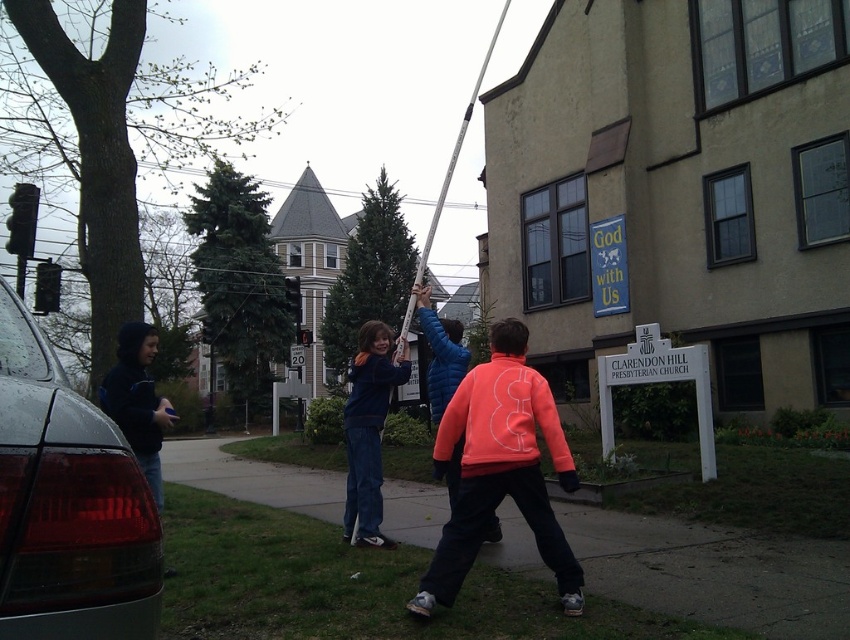
You are standing at the entrance of Clarendon Hill Presbyterian Church and notice a shiny black car at left and blue denim pants at center. Which object is nearer to you?

The shiny black car at left is closer to the viewer than the blue denim pants at center.

You are a delivery person trying to park your 1.8 meters tall delivery van. You see the smooth concrete sidewalk at center and the shiny black car at left. Which one is taller and can accommodate your van?

The smooth concrete sidewalk at center is much taller than the shiny black car at left. Since your delivery van is 1.8 meters tall, it can fit under the smooth concrete sidewalk at center as it is taller than the van, but the shiny black car at left is shorter and may not provide enough clearance.

You are a delivery person trying to navigate through the courtyard to deliver a package to the church entrance. There are two people in the scene wearing an orange fleece jacket at center and blue denim pants at center. What is the minimum width of the path needed to pass between them?

The orange fleece jacket at center and blue denim pants at center are 1.98 meters apart, so the minimum width of the path needed to pass between them is 1.98 meters.